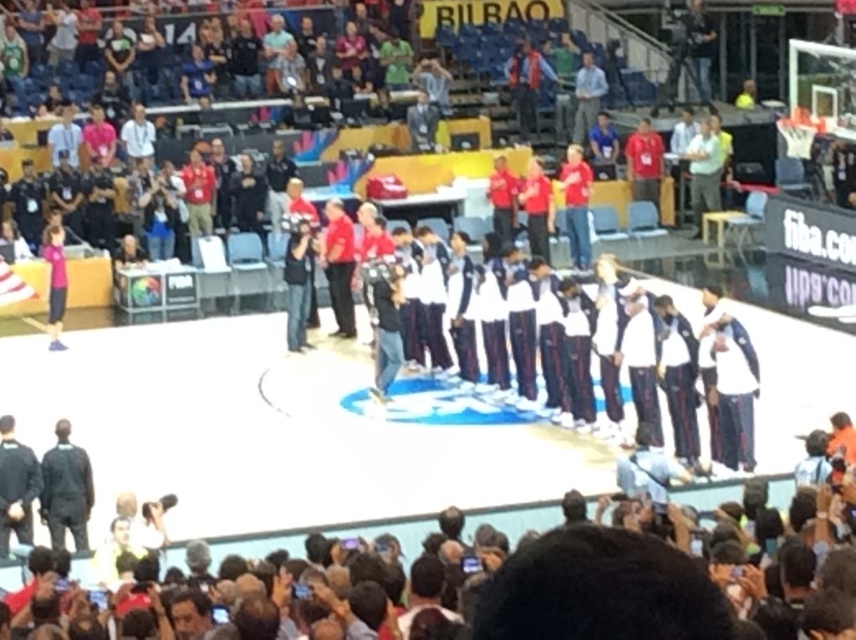
Who is more distant from viewer, (434, 292) or (63, 454)?

Point (434, 292)

Does point (590, 314) come farther from viewer compared to point (58, 515)?

Yes, it is.

The image size is (856, 640). What are the coordinates of `white fabric basketball team at center` in the screenshot? It's located at (464, 403).